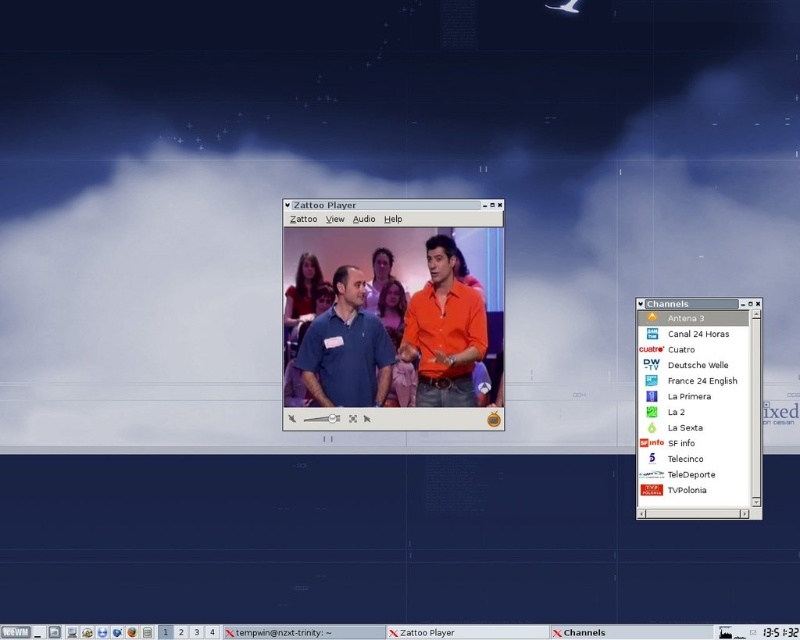
Between matte orange shirt at center and matte blue shirt at center, which one is positioned lower?

matte blue shirt at center

Does matte orange shirt at center appear on the left side of matte blue shirt at center?

Incorrect, matte orange shirt at center is not on the left side of matte blue shirt at center.

The height and width of the screenshot is (640, 800). Find the location of `matte orange shirt at center`. matte orange shirt at center is located at coordinates (386, 312).

Find the location of a particular element. This screenshot has height=640, width=800. matte orange shirt at center is located at coordinates (386, 312).

Which is above, orange matte shirt at center or transparent text at bottom?

Positioned higher is orange matte shirt at center.

Does orange matte shirt at center appear under transparent text at bottom?

No.

This screenshot has width=800, height=640. I want to click on orange matte shirt at center, so click(444, 330).

Which is behind, point (292, 634) or point (445, 627)?

The point (445, 627) is behind.

Which is above, transparent text at bottom or black matte zattoo player at bottom?

transparent text at bottom is above.

Where is `transparent text at bottom`? transparent text at bottom is located at coordinates (276, 632).